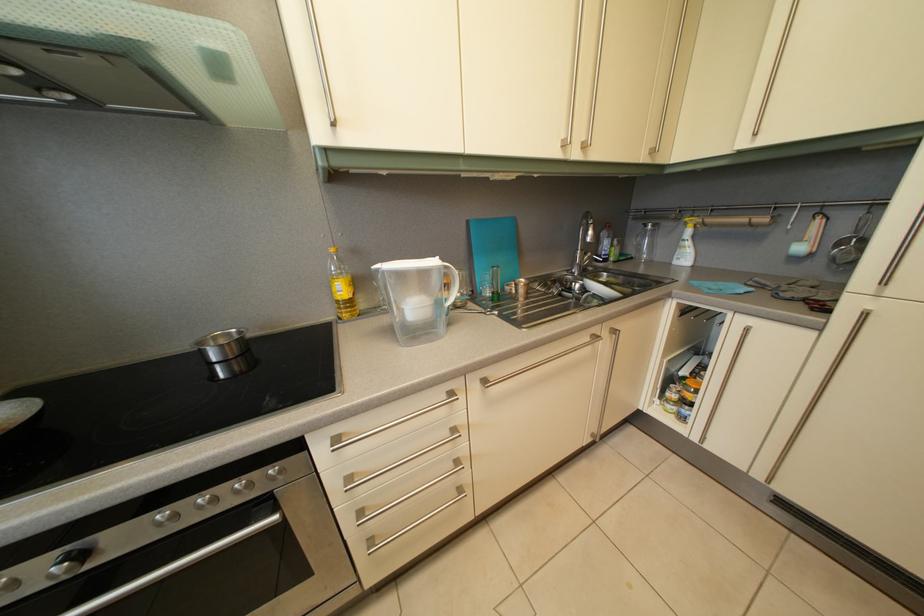
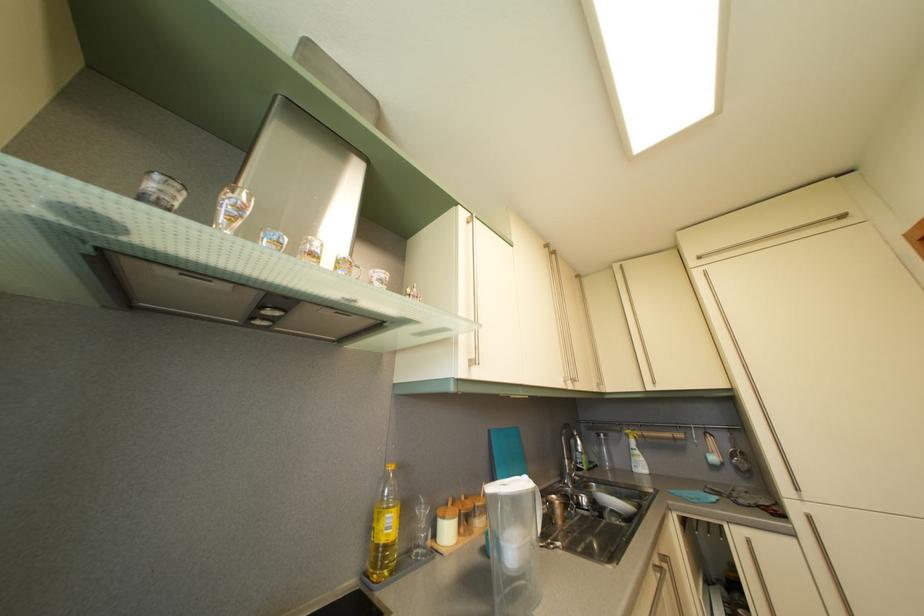
In the second image, find the point that corresponds to (x=349, y=297) in the first image.

(396, 533)